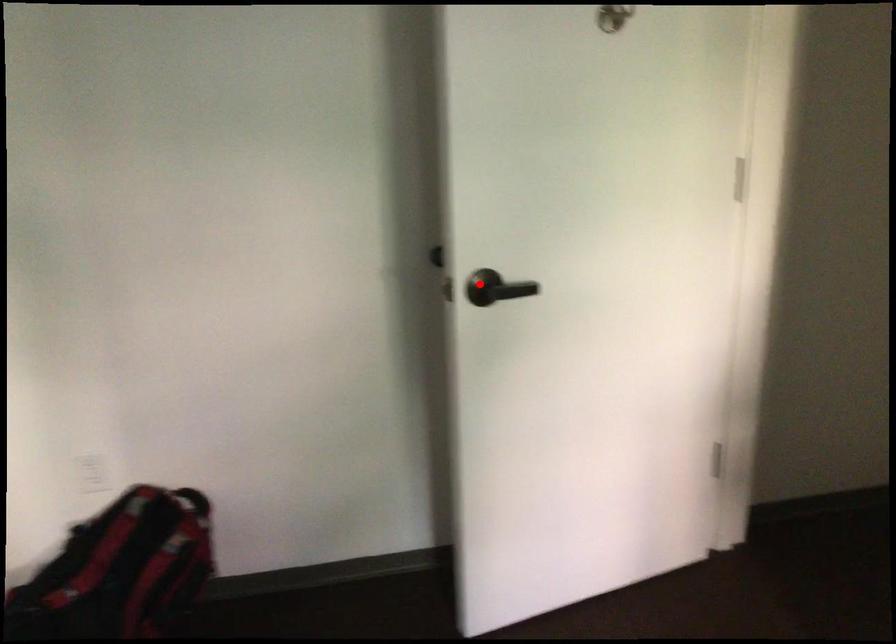
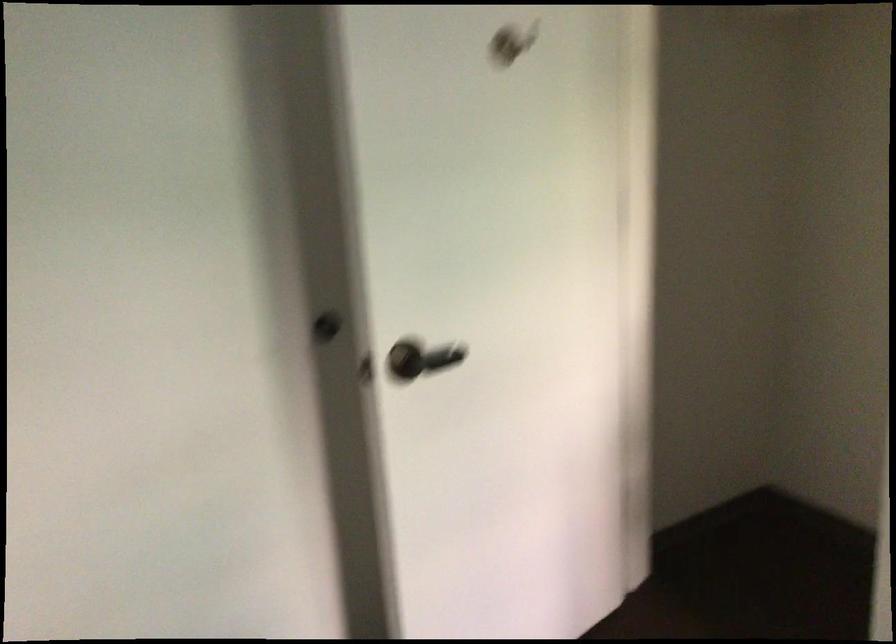
Question: I am providing you with two images of the same scene from different viewpoints. Image1 has a red point marked. In image2, the corresponding 3D location appears at what relative position? Reply with the corresponding letter.

Choices:
 (A) Closer
 (B) Farther

Answer: (A)